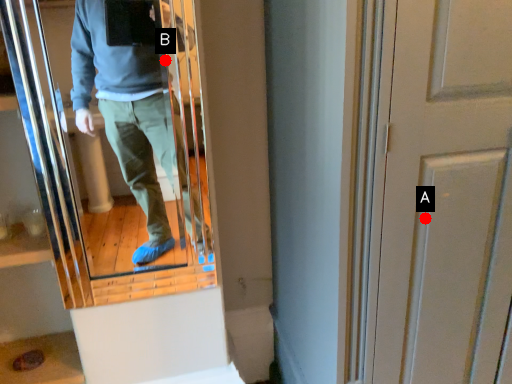
Question: Two points are circled on the image, labeled by A and B beside each circle. Which point is closer to the camera?

Choices:
 (A) A is closer
 (B) B is closer

Answer: (A)